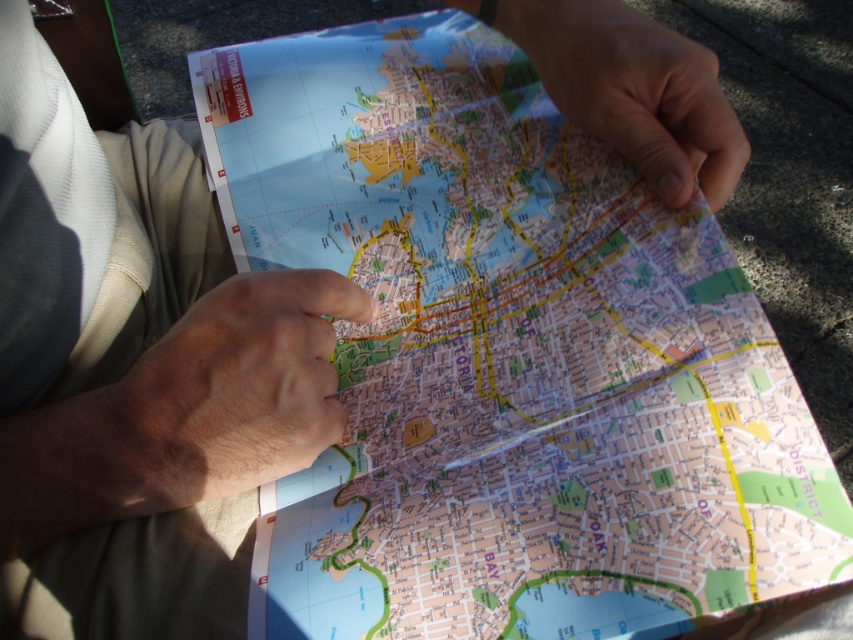
Between point (137, 492) and point (722, 122), which one is positioned behind?

The point (722, 122) is more distant.

Can you confirm if smooth skin hand at center is positioned above matte paper hand at upper right?

No, smooth skin hand at center is not above matte paper hand at upper right.

In order to click on smooth skin hand at center in this screenshot , I will do [x=230, y=392].